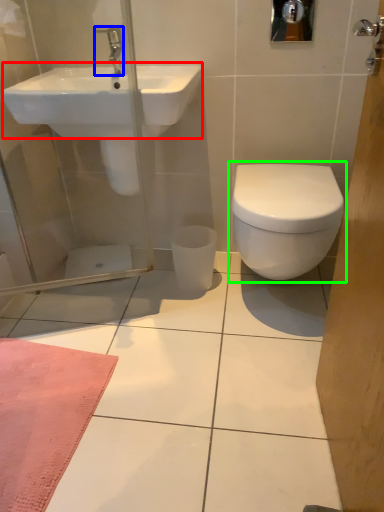
Question: Which object is the closest to the sink (highlighted by a red box)? Choose among these: tap (highlighted by a blue box) or toilet (highlighted by a green box).

Choices:
 (A) tap
 (B) toilet

Answer: (A)